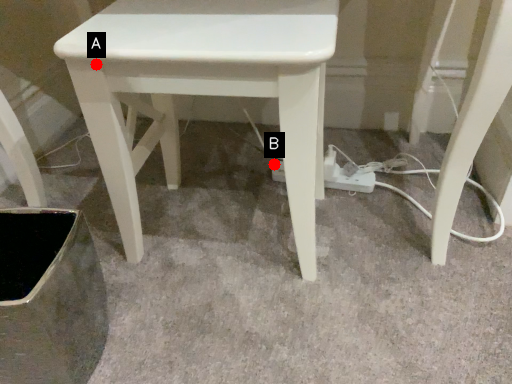
Question: Two points are circled on the image, labeled by A and B beside each circle. Which of the following is the closest to the observer?

Choices:
 (A) A is closer
 (B) B is closer

Answer: (A)